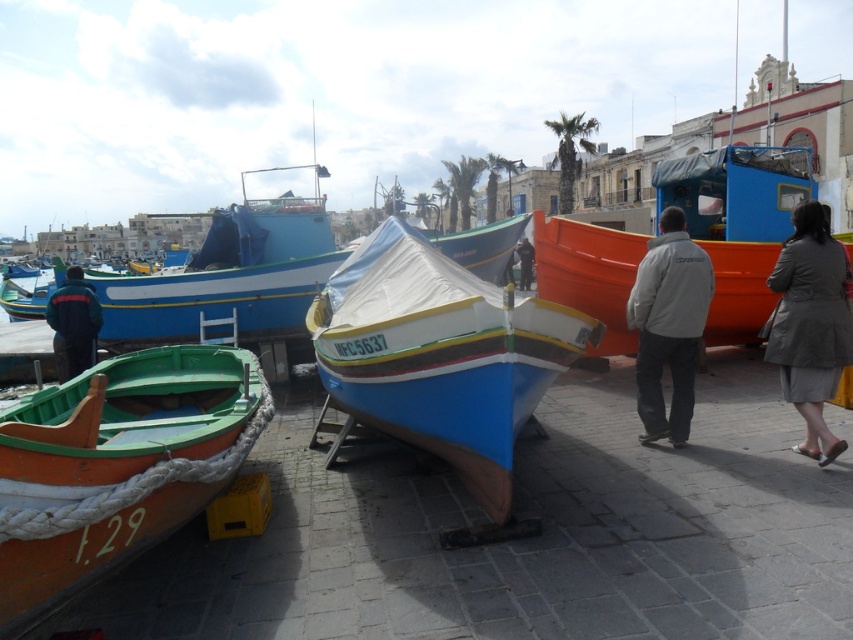
You are standing at the edge of the harbor looking at the green polished wood boat at lower left and the gray fabric coat at lower right. Which object is nearer to you?

The green polished wood boat at lower left is closer to the viewer than the gray fabric coat at lower right.

Looking at this image, you are standing at the center of the harbor scene. You need to locate the green polished wood boat at lower left. What are its coordinates?

The green polished wood boat at lower left is located at coordinates point (115,465).

Looking at this image, you are a delivery person needing to place a gray fabric coat at lower right next to the green polished wood boat at lower left. Can you fit the coat next to the boat without overlapping them?

A: The green polished wood boat at lower left might be wider than gray fabric coat at lower right, so there might be enough space to place the coat next to the boat without overlapping them.